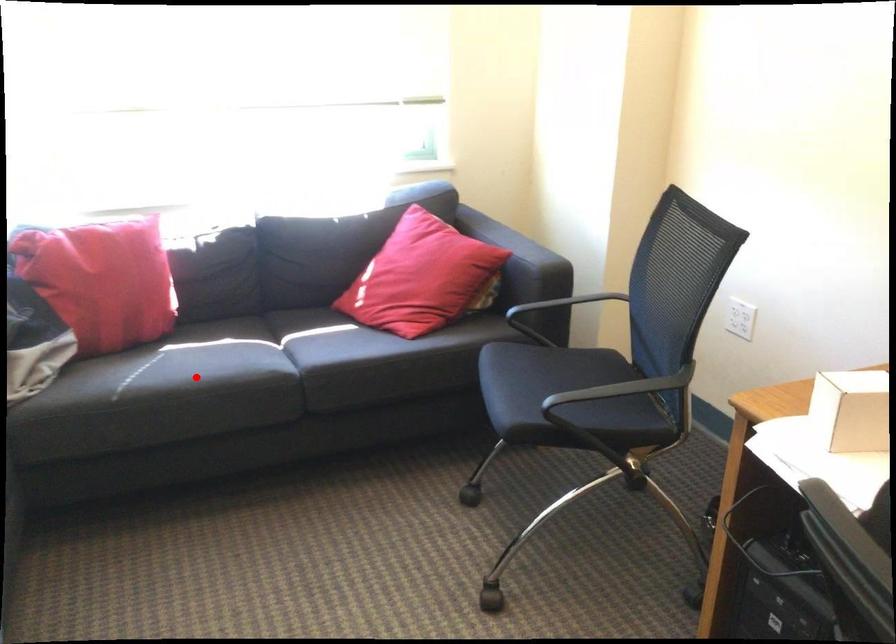
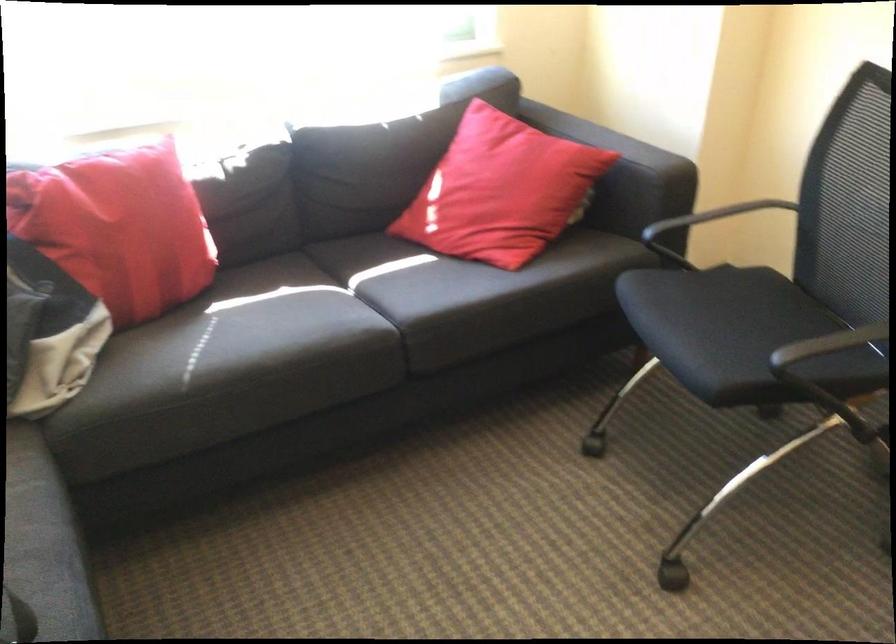
Question: I am providing you with two images of the same scene from different viewpoints. In image1, a red point is highlighted. Considering the same 3D point in image2, which of the following is correct?

Choices:
 (A) It is closer
 (B) It is farther

Answer: (A)